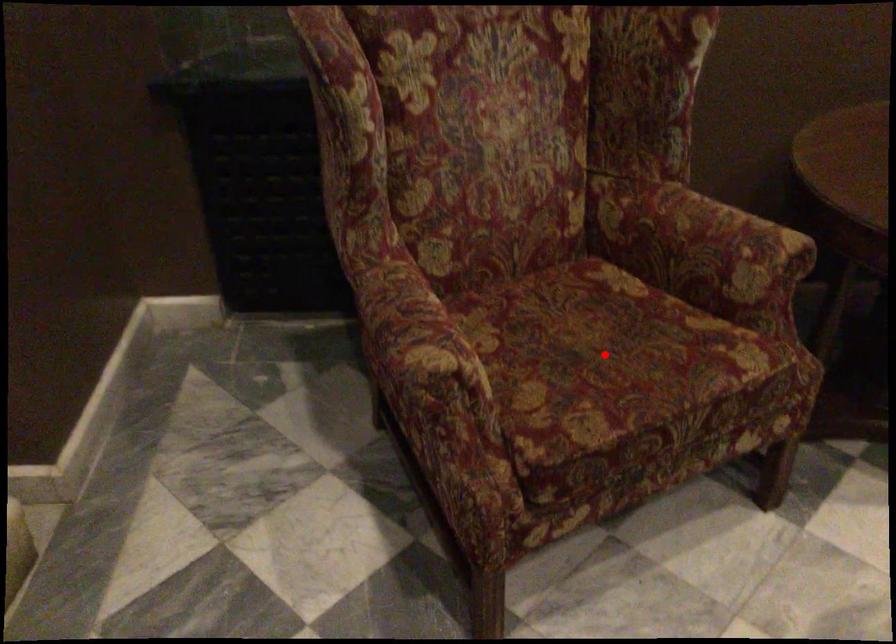
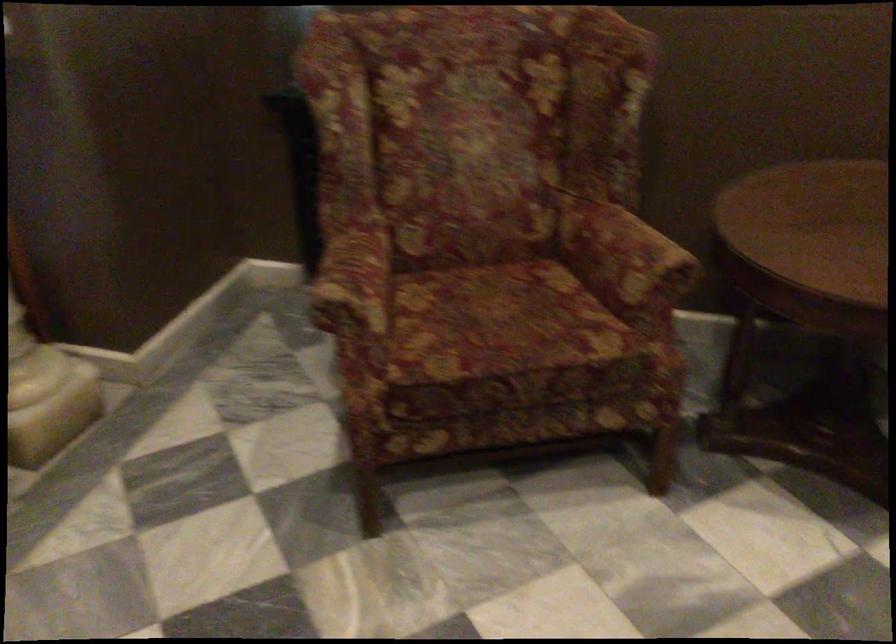
Where in the second image is the point corresponding to the highlighted location from the first image?

(501, 323)